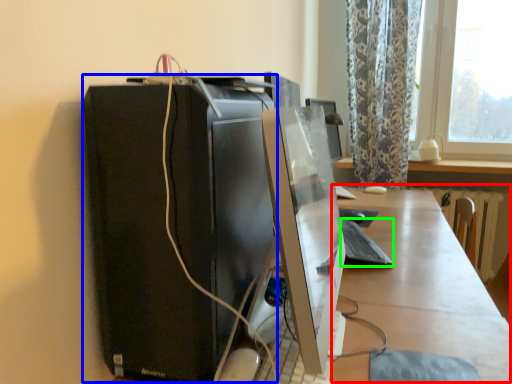
Question: Which object is positioned farthest from table (highlighted by a red box)? Select from computer tower (highlighted by a blue box) and computer keyboard (highlighted by a green box).

Choices:
 (A) computer tower
 (B) computer keyboard

Answer: (A)